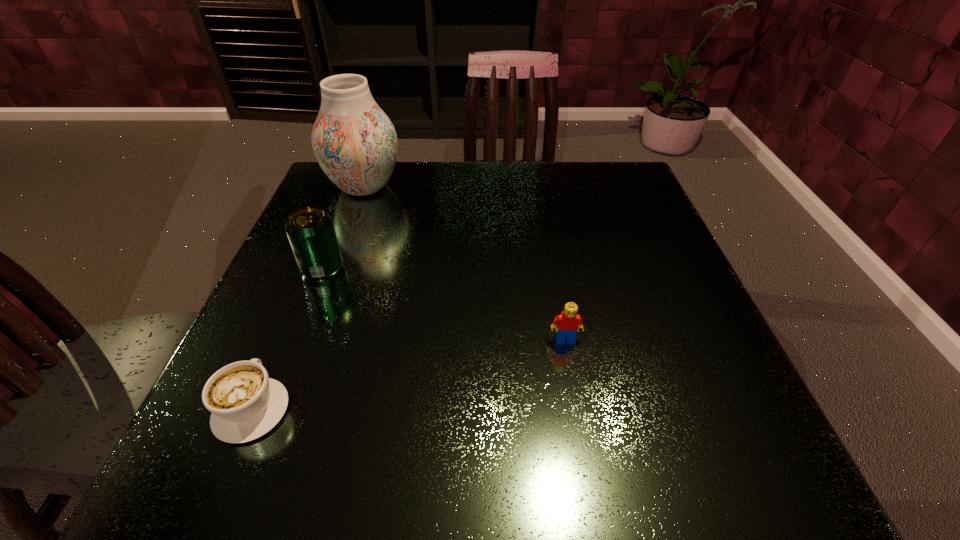
This screenshot has height=540, width=960. Identify the location of object at the near left corner. (245, 403).

Locate an element on the screen. This screenshot has width=960, height=540. vacant space at the far edge is located at coordinates (517, 186).

Locate an element on the screen. vacant space at the near edge is located at coordinates (461, 484).

The height and width of the screenshot is (540, 960). Find the location of `vacant space at the left edge`. vacant space at the left edge is located at coordinates (365, 255).

Where is `vacant point at the right edge`? Image resolution: width=960 pixels, height=540 pixels. vacant point at the right edge is located at coordinates (604, 277).

Locate an element on the screen. The height and width of the screenshot is (540, 960). vacant space at the far left corner of the desktop is located at coordinates (355, 209).

Locate an element on the screen. The height and width of the screenshot is (540, 960). vacant space at the near right corner of the desktop is located at coordinates (772, 448).

In order to click on blank region between the tallest object and the nearest object in this screenshot , I will do `click(308, 298)`.

Find the location of a particular element. This screenshot has height=540, width=960. free spot between the shortest object and the beer can is located at coordinates (287, 339).

The width and height of the screenshot is (960, 540). Find the location of `blank region between the second farthest object and the nearest object`. blank region between the second farthest object and the nearest object is located at coordinates (287, 339).